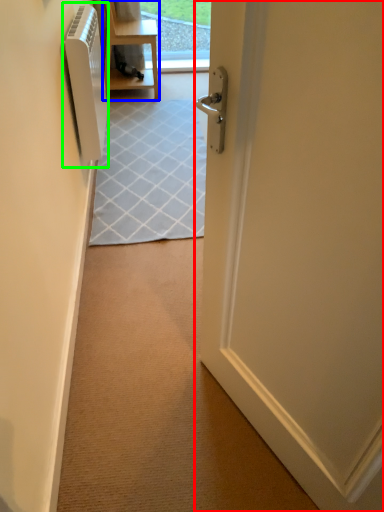
Question: Based on their relative distances, which object is farther from door (highlighted by a red box)? Choose from furniture (highlighted by a blue box) and air conditioner (highlighted by a green box).

Choices:
 (A) furniture
 (B) air conditioner

Answer: (A)